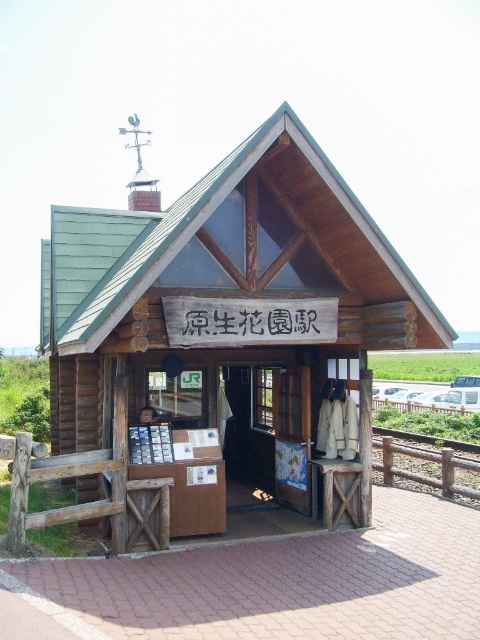
Based on the photo, you are standing at the entrance of the wooden cabin at center. If you walk straight ahead, will you exit the cabin through the back door or the side door?

The wooden cabin at center is positioned at coordinates point (224, 298), so walking straight ahead from the entrance would lead you toward the back door.